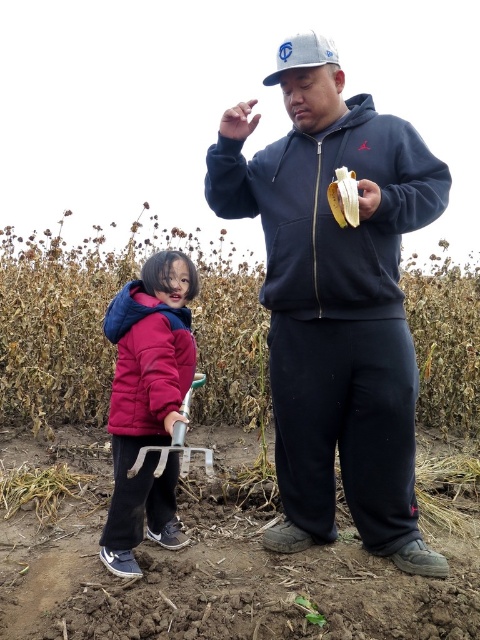
Is point (26, 528) closer to viewer compared to point (351, 202)?

No.

Is point (88, 568) positioned after point (355, 209)?

Yes, it is behind point (355, 209).

Identify the location of brown soil at center. (213, 573).

Does velvet maroon jacket at lower left appear on the right side of yellow matte banana at center?

No, velvet maroon jacket at lower left is not to the right of yellow matte banana at center.

Does velvet maroon jacket at lower left come in front of yellow matte banana at center?

No, it is not.

Is point (183, 317) more distant than point (357, 209)?

Yes.

This screenshot has width=480, height=640. In order to click on velvet maroon jacket at lower left in this screenshot , I will do `click(147, 403)`.

Is brown soil at center further to camera compared to white matte baseball cap at upper center?

No, brown soil at center is in front of white matte baseball cap at upper center.

Does point (63, 445) lie behind point (315, 49)?

That is True.

Is point (21, 620) farther from camera compared to point (304, 60)?

No.

Identify the location of brown soil at center. (213, 573).